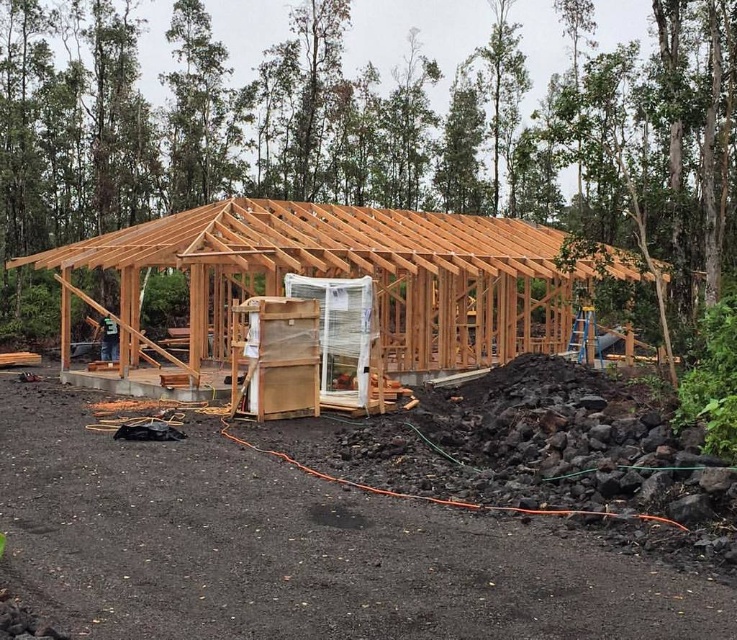
Question: Does natural wood frame at center appear over natural wood roof at center?

Choices:
 (A) no
 (B) yes

Answer: (A)

Question: Which point is closer to the camera?

Choices:
 (A) natural wood roof at center
 (B) natural wood frame at center

Answer: (B)

Question: Does natural wood frame at center have a smaller size compared to natural wood roof at center?

Choices:
 (A) no
 (B) yes

Answer: (B)

Question: Which point appears closest to the camera in this image?

Choices:
 (A) (237, 280)
 (B) (394, 268)

Answer: (B)

Question: Can you confirm if natural wood frame at center is bigger than natural wood roof at center?

Choices:
 (A) no
 (B) yes

Answer: (A)